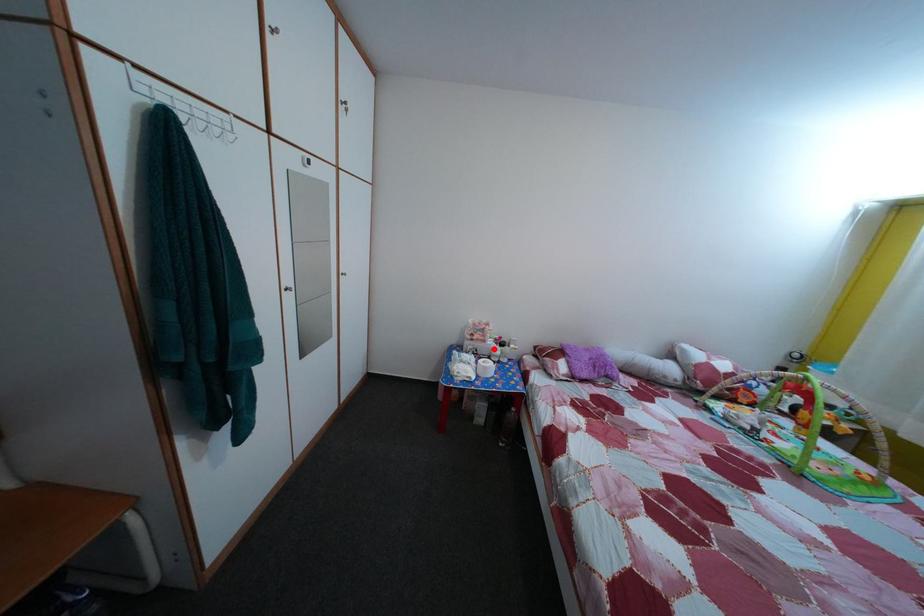
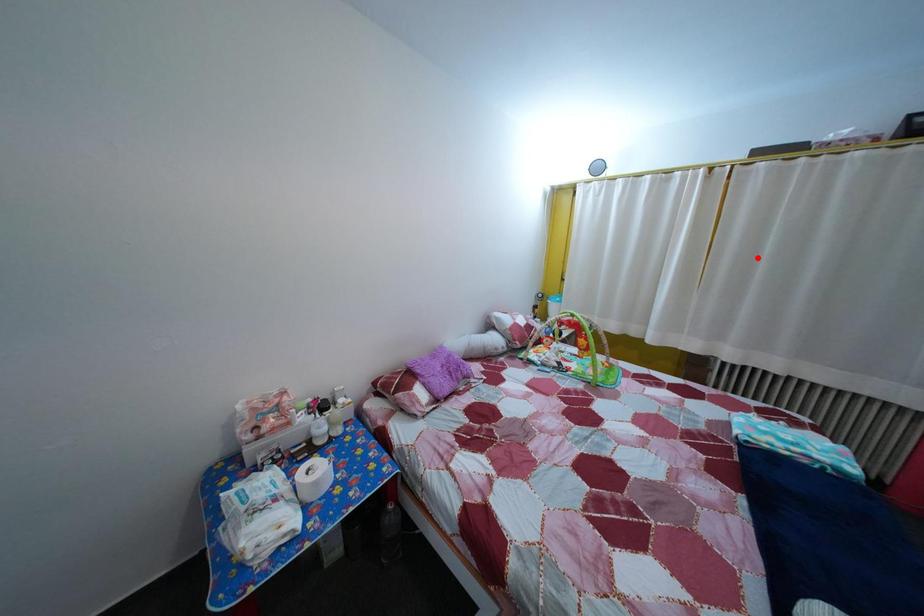
I am providing you with two images of the same scene from different viewpoints. A red point is marked on the first image and another point is marked on the second image. Do the highlighted points in image1 and image2 indicate the same real-world spot?

No